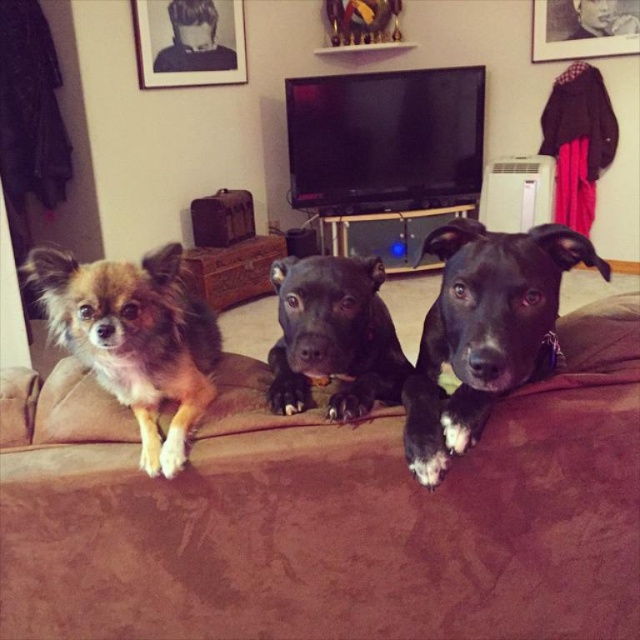
You are a dog trainer trying to place a treat between the black matte dog at center and the fuzzy brown dog at left. Can you fit the treat in the space between them if the treat is 18 inches long?

The black matte dog at center is 19.03 inches away from the fuzzy brown dog at left. Since the treat is 18 inches long, it can fit in the space between them as the distance is slightly larger than the treat.

Based on the photo, you are a pet sitter entering the living room and see the brown fabric couch at center and the black matte dog at center. Which object is positioned higher in the scene?

The black matte dog at center is positioned higher than the brown fabric couch at center, as the couch is located below it.

You are sitting on the floor in front of the brown fabric couch at center and the fuzzy brown dog at left. Which object is closer to you?

The brown fabric couch at center is closer to you than the fuzzy brown dog at left.